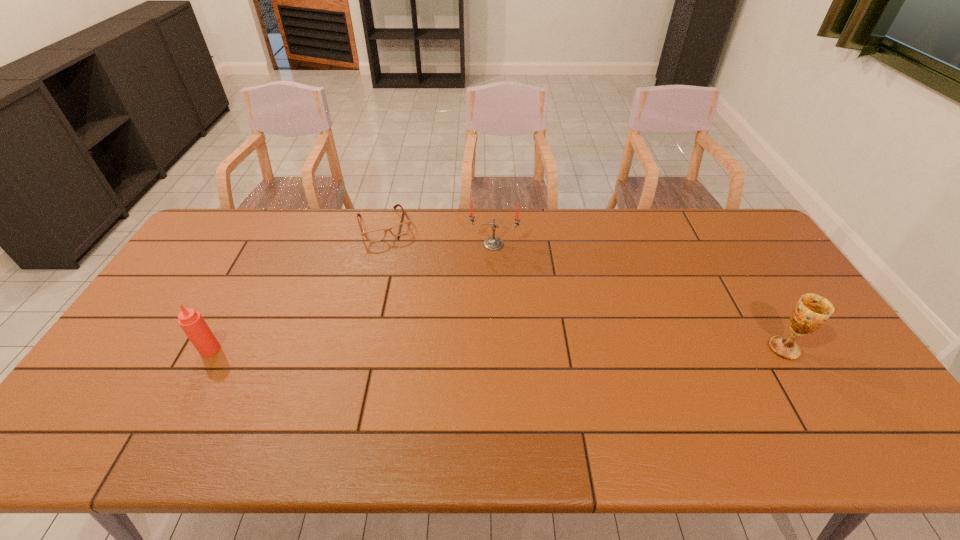
At what (x,y) coordinates should I click in order to perform the action: click on vacant area between the candle and the third object from right to left. Please return your answer as a coordinate pair (x, y). Image resolution: width=960 pixels, height=540 pixels. Looking at the image, I should click on (440, 235).

I want to click on object that is the second closest to the leftmost object, so click(x=493, y=243).

At what (x,y) coordinates should I click in order to perform the action: click on object identified as the third closest to the second object from left to right. Please return your answer as a coordinate pair (x, y). The height and width of the screenshot is (540, 960). Looking at the image, I should click on (812, 311).

You are a GUI agent. You are given a task and a screenshot of the screen. Output one action in this format:
    pyautogui.click(x=<x>, y=<y>)
    Task: Click on the free space that satisfies the following two spatial constraints: 1. on the front side of the second object from right to left; 2. on the right side of the rightmost object
    The width and height of the screenshot is (960, 540).
    Given the screenshot: What is the action you would take?
    pyautogui.click(x=497, y=349)

Image resolution: width=960 pixels, height=540 pixels. Identify the location of free region that satisfies the following two spatial constraints: 1. on the front side of the third object from left to right; 2. on the left side of the rightmost object. (497, 349).